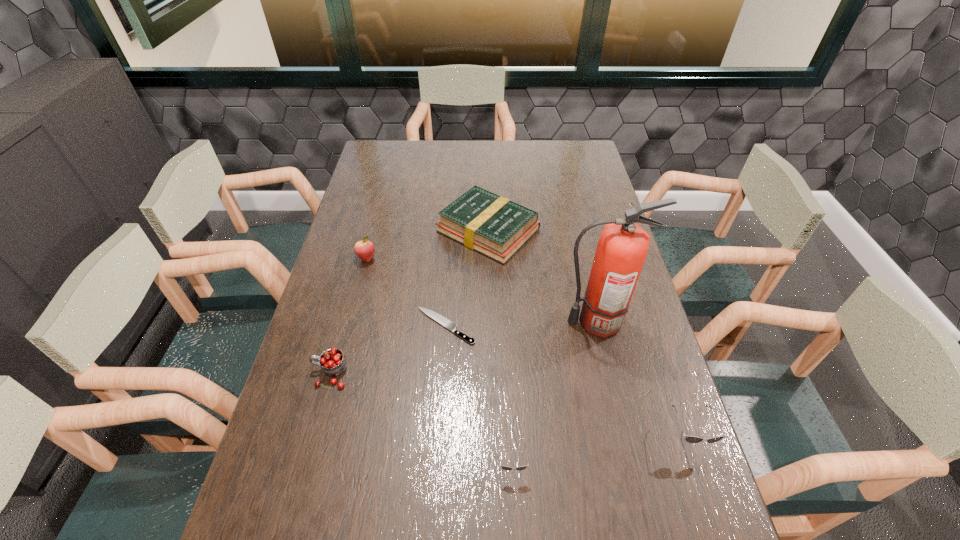
The height and width of the screenshot is (540, 960). I want to click on the left sunglasses, so click(503, 467).

The image size is (960, 540). I want to click on the shorter sunglasses, so click(x=503, y=467).

Locate an element on the screen. the taller sunglasses is located at coordinates (691, 439).

Find the location of a particular element. This screenshot has width=960, height=540. the third shortest object is located at coordinates (492, 225).

Image resolution: width=960 pixels, height=540 pixels. I want to click on the shortest object, so click(x=442, y=320).

You are a GUI agent. You are given a task and a screenshot of the screen. Output one action in this format:
    pyautogui.click(x=<x>, y=<y>)
    Task: Click on the apple
    
    Given the screenshot: What is the action you would take?
    pyautogui.click(x=364, y=249)

Identify the location of fire extinguisher. The image size is (960, 540). (622, 248).

The image size is (960, 540). I want to click on the third nearest object, so click(x=332, y=361).

You are a GUI agent. You are given a task and a screenshot of the screen. Output one action in this format:
    pyautogui.click(x=<x>, y=<y>)
    Task: Click on the free location located in front of the lenses of the second shortest object
    The height and width of the screenshot is (540, 960).
    Given the screenshot: What is the action you would take?
    pyautogui.click(x=515, y=515)

Locate an element on the screen. free space located in front of the lenses of the taller sunglasses is located at coordinates (706, 490).